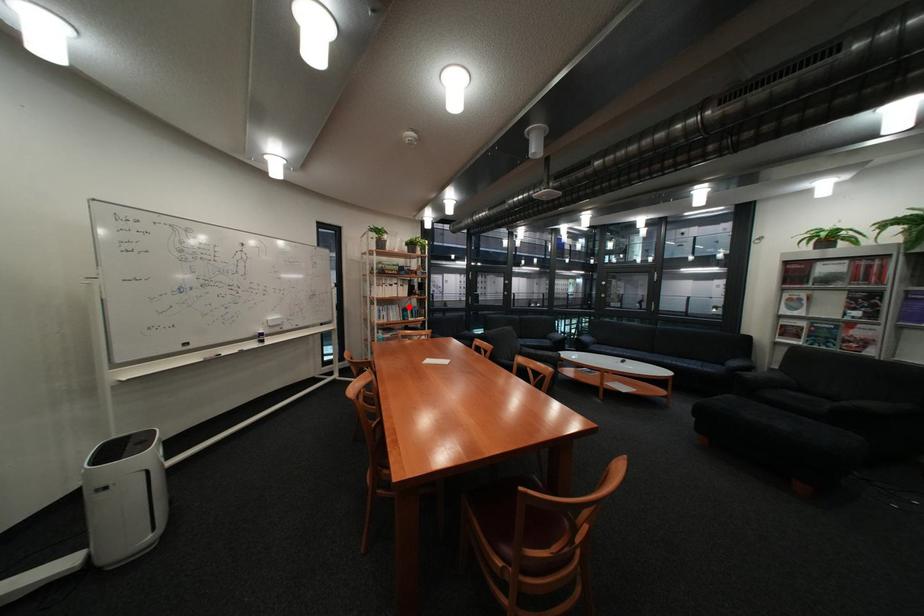
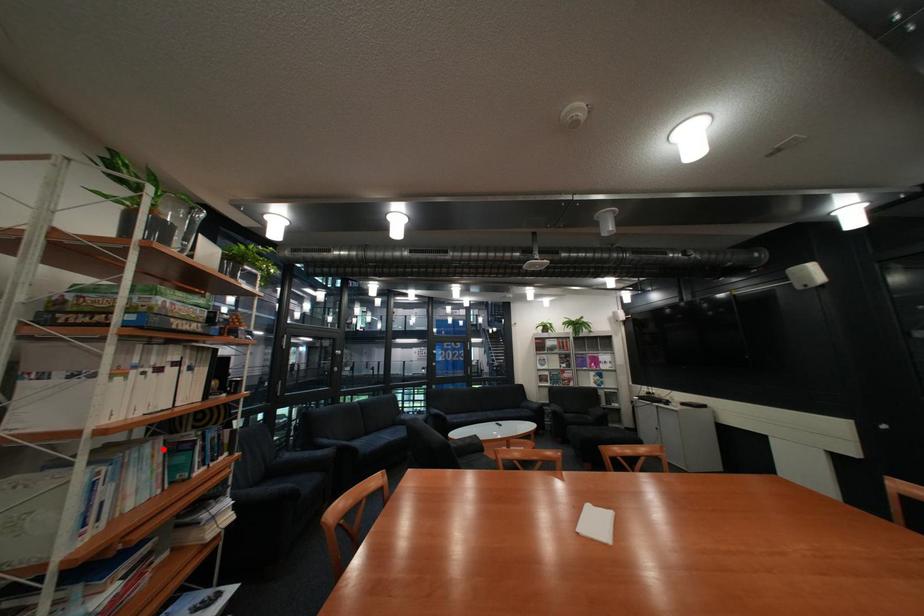
I am providing you with two images of the same scene from different viewpoints. A red point is marked on the first image and another point is marked on the second image. Does the point marked in image1 correspond to the same location as the one in image2?

Yes